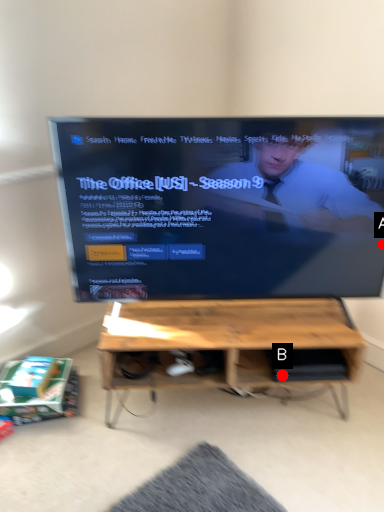
Question: Two points are circled on the image, labeled by A and B beside each circle. Which of the following is the farthest from the observer?

Choices:
 (A) A is further
 (B) B is further

Answer: (B)